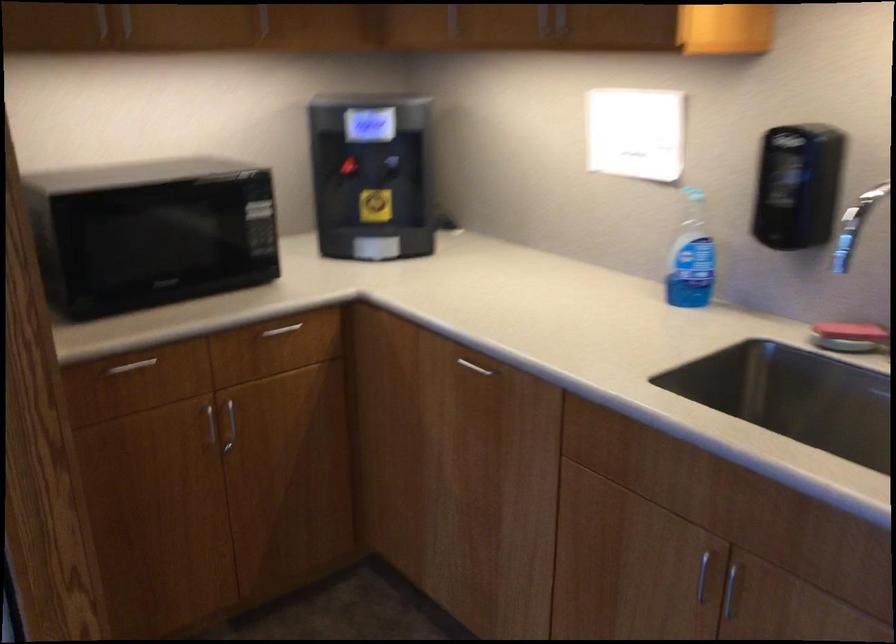
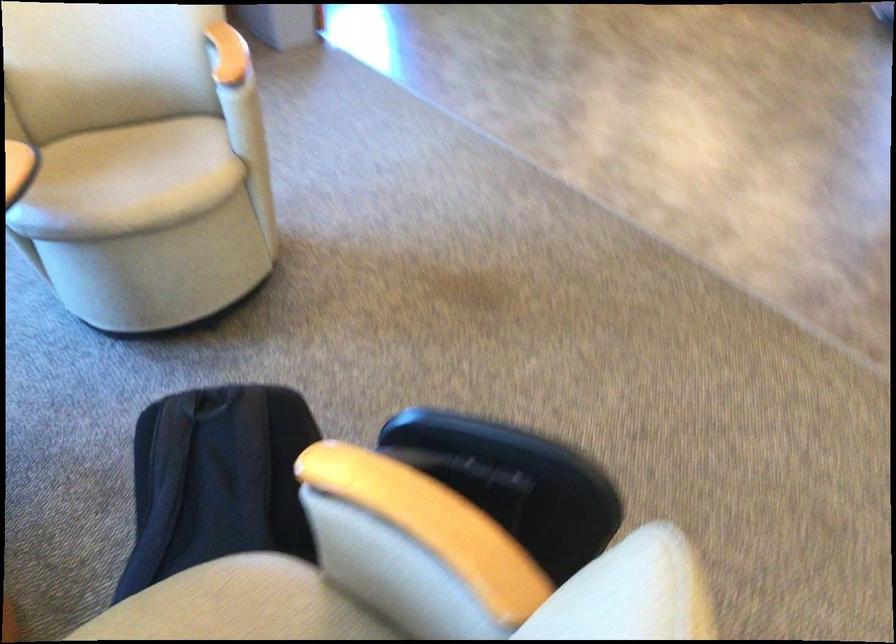
The images are taken continuously from a first-person perspective. In which direction are you moving?

The cameraman moved toward left, backward.